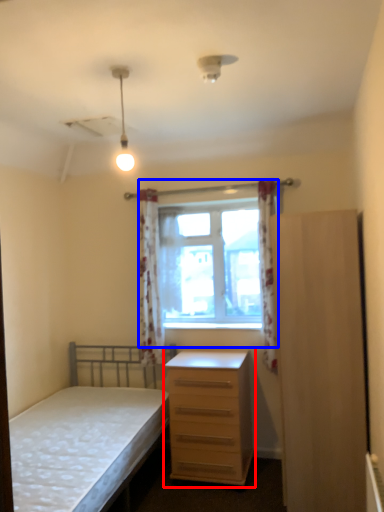
Question: Among these objects, which one is nearest to the camera, chest of drawers (highlighted by a red box) or window (highlighted by a blue box)?

Choices:
 (A) chest of drawers
 (B) window

Answer: (A)